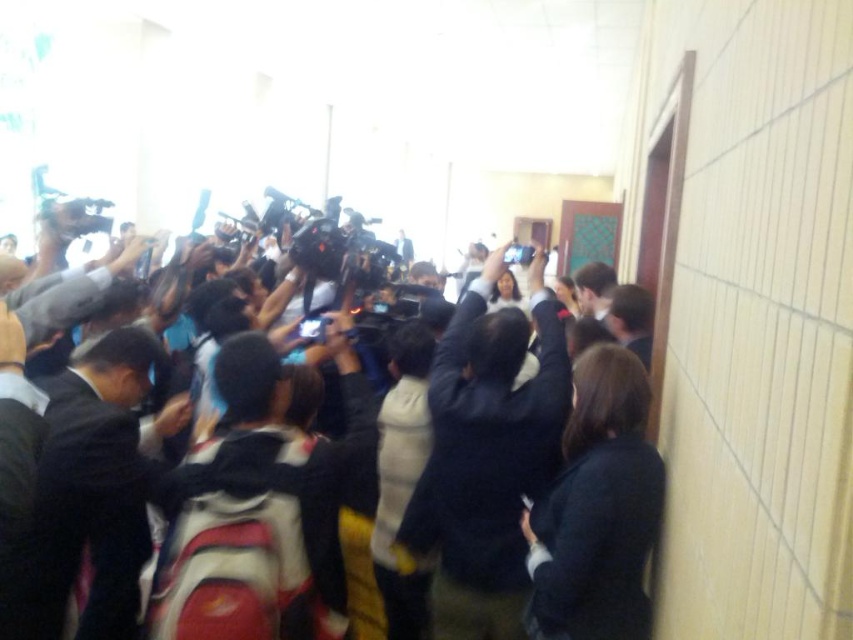
Question: Is white cotton jacket at center positioned in front of black fabric crowd at center?

Choices:
 (A) yes
 (B) no

Answer: (B)

Question: Among these points, which one is farthest from the camera?

Choices:
 (A) (560, 433)
 (B) (111, 636)

Answer: (A)

Question: Can you confirm if white cotton jacket at center is positioned above black fabric crowd at center?

Choices:
 (A) yes
 (B) no

Answer: (A)

Question: Among these points, which one is nearest to the camera?

Choices:
 (A) (490, 612)
 (B) (454, 401)

Answer: (B)

Question: In this image, where is white cotton jacket at center located relative to black fabric crowd at center?

Choices:
 (A) above
 (B) below

Answer: (A)